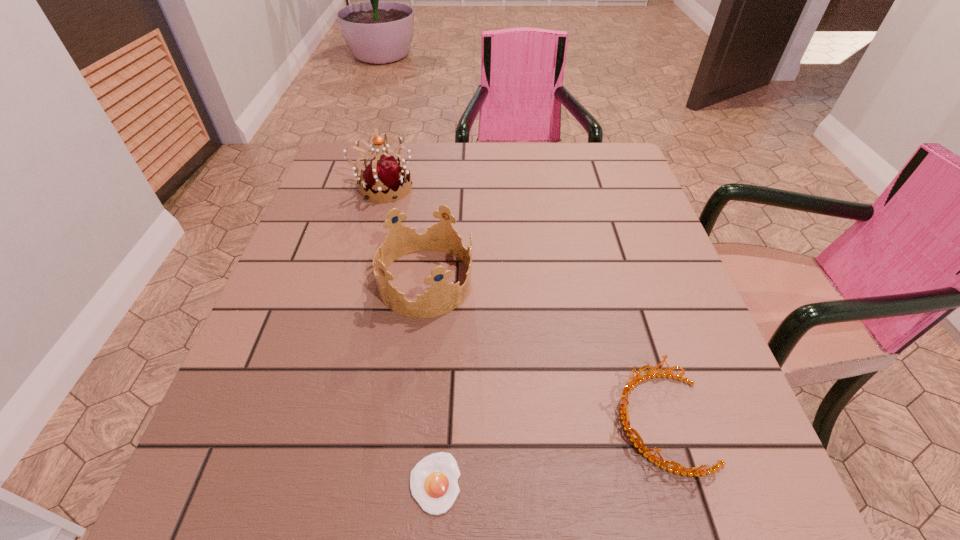
Identify the location of the farthest tiara. Image resolution: width=960 pixels, height=540 pixels. (384, 175).

The height and width of the screenshot is (540, 960). I want to click on the farthest object, so click(x=384, y=175).

Identify the location of the second shortest tiara. This screenshot has height=540, width=960. (443, 297).

Where is `the third shortest object`? the third shortest object is located at coordinates (443, 297).

You are a GUI agent. You are given a task and a screenshot of the screen. Output one action in this format:
    pyautogui.click(x=<x>, y=<y>)
    Task: Click on the rightmost tiara
    
    Given the screenshot: What is the action you would take?
    pyautogui.click(x=630, y=385)

This screenshot has height=540, width=960. In order to click on the rightmost object in this screenshot , I will do `click(630, 385)`.

Where is `the shortest object`? The width and height of the screenshot is (960, 540). the shortest object is located at coordinates (433, 480).

The height and width of the screenshot is (540, 960). Find the location of `vacant area situated on the front-facing side of the farthest object`. vacant area situated on the front-facing side of the farthest object is located at coordinates (468, 188).

Locate an element on the screen. free space located 0.190m on the front-facing side of the second farthest tiara is located at coordinates (564, 281).

You are a GUI agent. You are given a task and a screenshot of the screen. Output one action in this format:
    pyautogui.click(x=<x>, y=<y>)
    Task: Click on the vacant area situated on the front-facing side of the rightmost object
    The height and width of the screenshot is (540, 960).
    Given the screenshot: What is the action you would take?
    pyautogui.click(x=384, y=422)